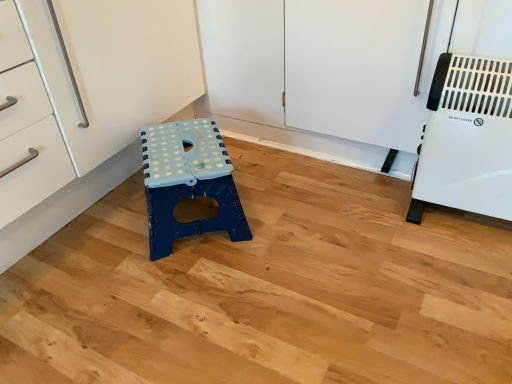
Question: Should I look upward or downward to see blue plastic stool at center?

Choices:
 (A) up
 (B) down

Answer: (A)

Question: Is white plastic heater at right placed right next to blue plastic stool at center?

Choices:
 (A) yes
 (B) no

Answer: (B)

Question: From the image's perspective, is white plastic heater at right on top of blue plastic stool at center?

Choices:
 (A) yes
 (B) no

Answer: (A)

Question: From a real-world perspective, is white plastic heater at right beneath blue plastic stool at center?

Choices:
 (A) yes
 (B) no

Answer: (B)

Question: Is white plastic heater at right oriented away from blue plastic stool at center?

Choices:
 (A) yes
 (B) no

Answer: (B)

Question: From a real-world perspective, is white plastic heater at right located higher than blue plastic stool at center?

Choices:
 (A) yes
 (B) no

Answer: (A)

Question: Is white plastic heater at right shorter than blue plastic stool at center?

Choices:
 (A) no
 (B) yes

Answer: (A)

Question: From the image's perspective, is blue plastic stool at center on top of white plastic heater at right?

Choices:
 (A) no
 (B) yes

Answer: (A)

Question: From a real-world perspective, is blue plastic stool at center located beneath white plastic heater at right?

Choices:
 (A) yes
 (B) no

Answer: (A)

Question: Is blue plastic stool at center looking in the opposite direction of white plastic heater at right?

Choices:
 (A) yes
 (B) no

Answer: (B)

Question: From a real-world perspective, is blue plastic stool at center on white plastic heater at right?

Choices:
 (A) no
 (B) yes

Answer: (A)

Question: Would you say blue plastic stool at center is a long distance from white plastic heater at right?

Choices:
 (A) yes
 (B) no

Answer: (B)

Question: Does blue plastic stool at center come behind white plastic heater at right?

Choices:
 (A) no
 (B) yes

Answer: (B)

Question: From the image's perspective, is white plastic heater at right above or below blue plastic stool at center?

Choices:
 (A) above
 (B) below

Answer: (A)